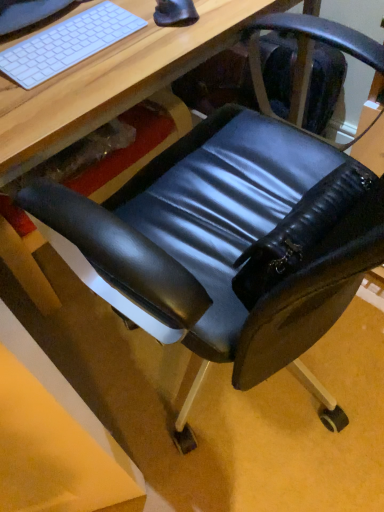
Question: Considering their positions, is white matte keyboard at upper left located in front of or behind black rubber mouse at upper center?

Choices:
 (A) front
 (B) behind

Answer: (A)

Question: From the image's perspective, is white matte keyboard at upper left above or below black rubber mouse at upper center?

Choices:
 (A) above
 (B) below

Answer: (B)

Question: Which is farther from the black rubber mouse at upper center?

Choices:
 (A) matte black chair at lower right
 (B) black leather swivel chair at center
 (C) white matte keyboard at upper left

Answer: (B)

Question: Considering the real-world distances, which object is closest to the black leather swivel chair at center?

Choices:
 (A) white matte keyboard at upper left
 (B) black rubber mouse at upper center
 (C) matte black chair at lower right

Answer: (C)